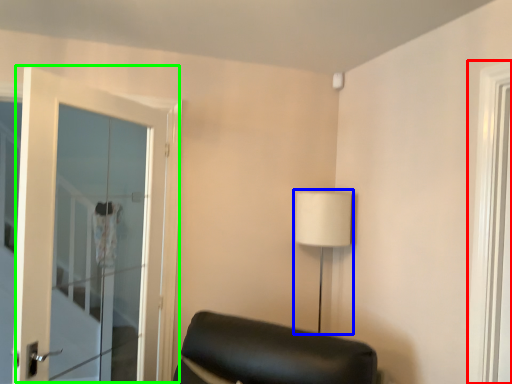
Question: Estimate the real-world distances between objects in this image. Which object is closer to window (highlighted by a red box), table lamp (highlighted by a blue box) or door (highlighted by a green box)?

Choices:
 (A) table lamp
 (B) door

Answer: (A)